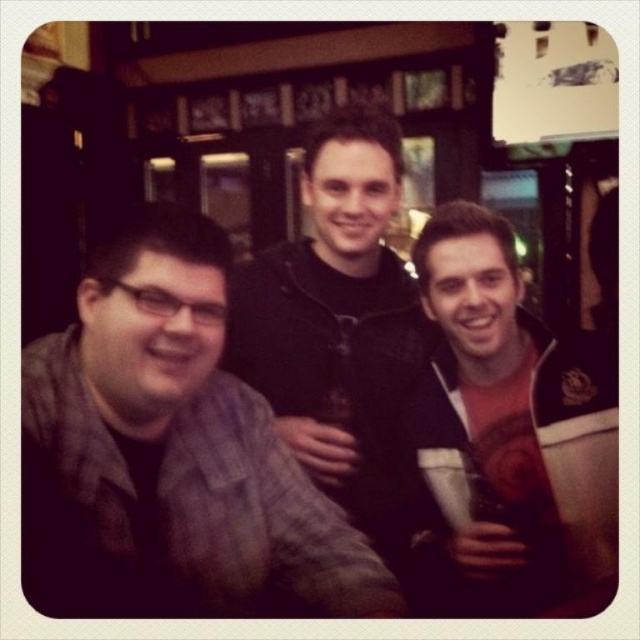
Question: Which point is farther to the camera?

Choices:
 (A) (316, 129)
 (B) (22, 387)
 (C) (516, 330)

Answer: (A)

Question: Which of these objects is positioned closest to the black matte jacket at center?

Choices:
 (A) plaid fabric shirt at left
 (B) white matte cup at center

Answer: (B)

Question: Among these objects, which one is nearest to the camera?

Choices:
 (A) white matte cup at center
 (B) plaid fabric shirt at left
 (C) black matte jacket at center

Answer: (B)

Question: In this image, where is plaid fabric shirt at left located relative to black matte jacket at center?

Choices:
 (A) above
 (B) below

Answer: (B)

Question: Is plaid fabric shirt at left bigger than white matte cup at center?

Choices:
 (A) yes
 (B) no

Answer: (B)

Question: Does plaid fabric shirt at left come in front of white matte cup at center?

Choices:
 (A) yes
 (B) no

Answer: (A)